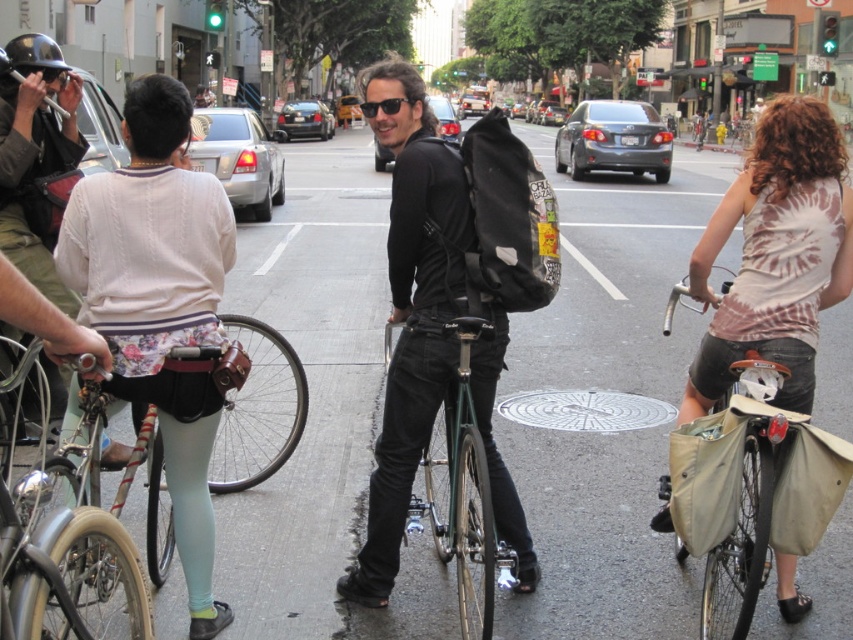
Is silver metallic bicycle at left wider than white tie-dye tank top at right?

Indeed, silver metallic bicycle at left has a greater width compared to white tie-dye tank top at right.

You are a GUI agent. You are given a task and a screenshot of the screen. Output one action in this format:
    pyautogui.click(x=<x>, y=<y>)
    Task: Click on the silver metallic bicycle at left
    This screenshot has width=853, height=640.
    Given the screenshot: What is the action you would take?
    pyautogui.click(x=62, y=560)

At what (x,y) coordinates should I click in order to perform the action: click on silver metallic bicycle at left. Please return your answer as a coordinate pair (x, y). Looking at the image, I should click on (62, 560).

From the picture: Is black matte backpack at center positioned before silver metallic bicycle at left?

No, black matte backpack at center is behind silver metallic bicycle at left.

Does black matte backpack at center have a greater height compared to silver metallic bicycle at left?

No, black matte backpack at center is not taller than silver metallic bicycle at left.

The image size is (853, 640). Describe the element at coordinates (410, 310) in the screenshot. I see `black matte backpack at center` at that location.

The image size is (853, 640). What are the coordinates of `black matte backpack at center` in the screenshot? It's located at (410, 310).

Does point (437, 304) come closer to viewer compared to point (6, 76)?

That is True.

Does point (376, 138) come closer to viewer compared to point (0, 58)?

Yes, it is.

Where is `black matte backpack at center`? The image size is (853, 640). black matte backpack at center is located at coordinates (410, 310).